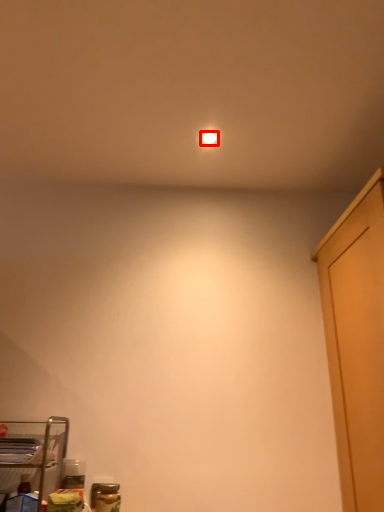
Question: From the image's perspective, where is lighting (annotated by the red box) located relative to furniture?

Choices:
 (A) below
 (B) above

Answer: (B)